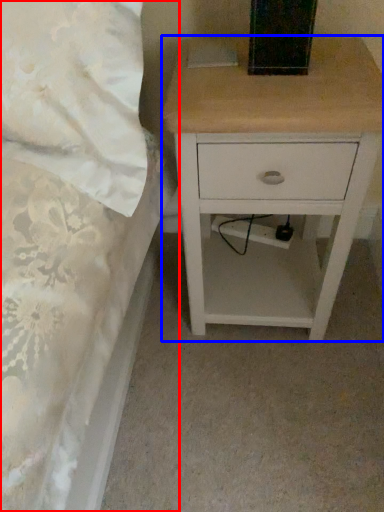
Question: Which object is closer to the camera taking this photo, bed (highlighted by a red box) or nightstand (highlighted by a blue box)?

Choices:
 (A) bed
 (B) nightstand

Answer: (A)